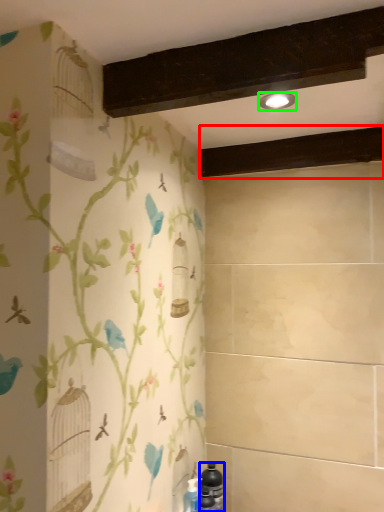
Question: Considering the real-world distances, which object is closest to plank (highlighted by a red box)? bottle (highlighted by a blue box) or light fixture (highlighted by a green box).

Choices:
 (A) bottle
 (B) light fixture

Answer: (B)